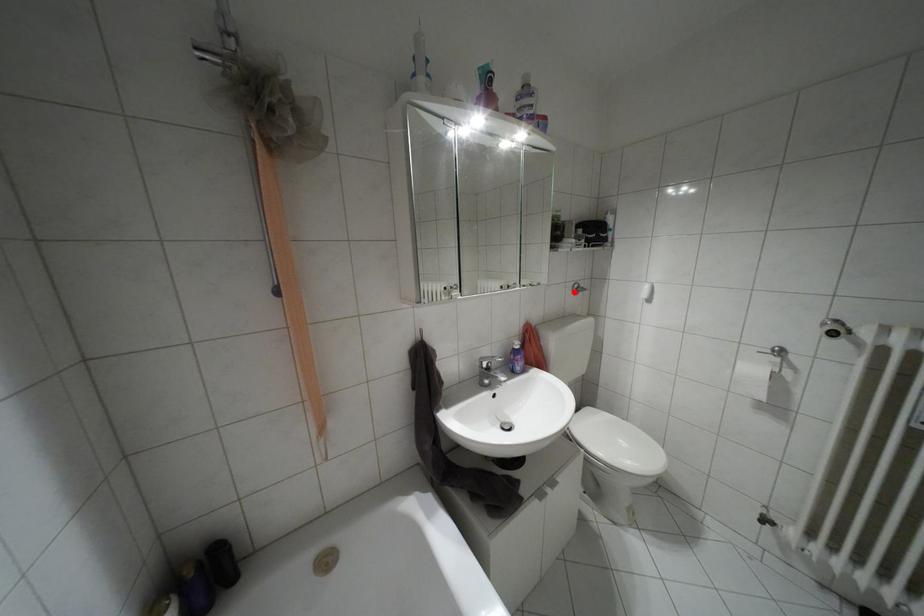
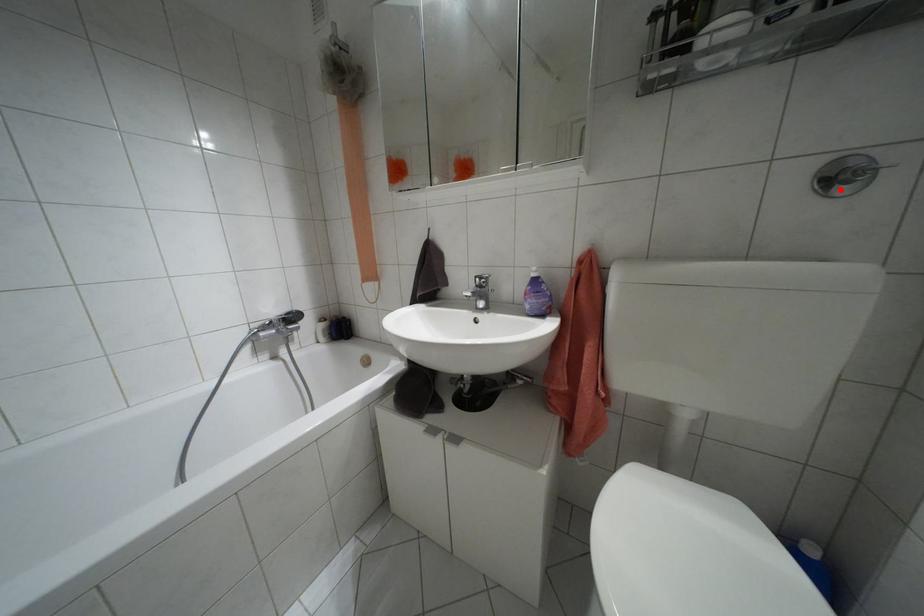
I am providing you with two images of the same scene from different viewpoints. A red point is marked on the first image and another point is marked on the second image. Do the highlighted points in image1 and image2 indicate the same real-world spot?

Yes